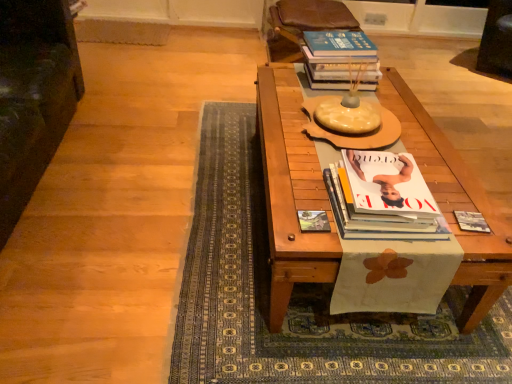
Where is `spots to the right of matte paper book cover at center`? spots to the right of matte paper book cover at center is located at coordinates (366, 241).